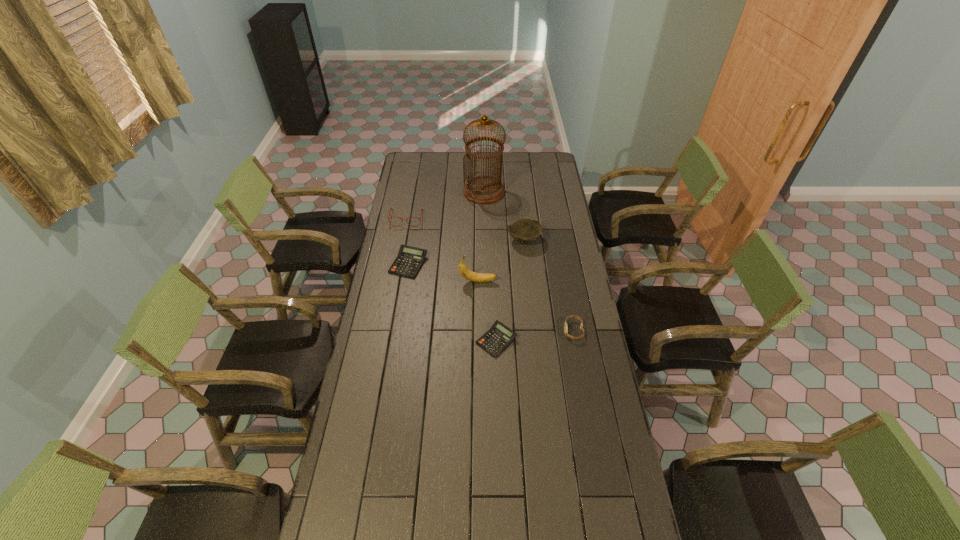
The height and width of the screenshot is (540, 960). I want to click on vacant region between the farther calculator and the nearer calculator, so click(x=452, y=302).

Identify the location of free space between the sixth tallest object and the right calculator. The height and width of the screenshot is (540, 960). (452, 302).

Locate an element on the screen. unoccupied position between the second shortest object and the banana is located at coordinates (444, 273).

The width and height of the screenshot is (960, 540). What are the coordinates of `unoccupied area between the watch and the farther calculator` in the screenshot? It's located at (491, 298).

The height and width of the screenshot is (540, 960). What are the coordinates of `free area in between the left calculator and the fifth shortest object` in the screenshot? It's located at (467, 252).

Where is `vacant area that lies between the birdcage and the second tallest object`? Image resolution: width=960 pixels, height=540 pixels. vacant area that lies between the birdcage and the second tallest object is located at coordinates (481, 237).

You are a GUI agent. You are given a task and a screenshot of the screen. Output one action in this format:
    pyautogui.click(x=<x>, y=<y>)
    Task: Click on the free spot between the fifth shortest object and the banana
    The height and width of the screenshot is (540, 960).
    Given the screenshot: What is the action you would take?
    pyautogui.click(x=501, y=260)

Locate an element on the screen. This screenshot has height=540, width=960. free space that is in between the second shortest object and the tallest object is located at coordinates (446, 228).

Where is `vacant space that is in between the sixth shortest object and the fourth tallest object`? This screenshot has width=960, height=540. vacant space that is in between the sixth shortest object and the fourth tallest object is located at coordinates (443, 249).

At what (x,y) coordinates should I click in order to perform the action: click on unoccupied position between the right calculator and the left calculator. Please return your answer as a coordinate pair (x, y). This screenshot has width=960, height=540. Looking at the image, I should click on (452, 302).